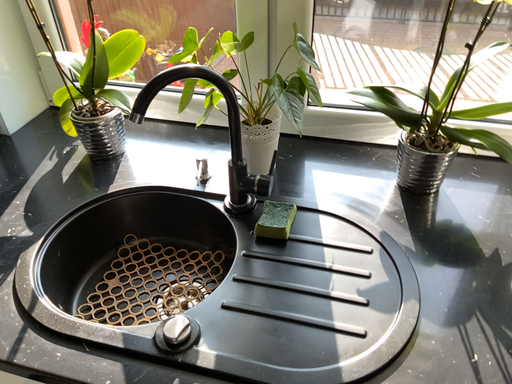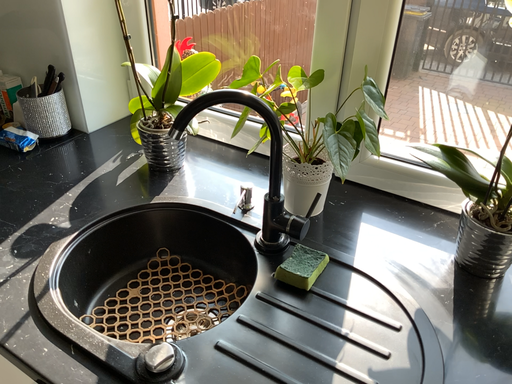
Question: How did the camera likely rotate when shooting the video?

Choices:
 (A) rotated upward
 (B) rotated downward

Answer: (A)